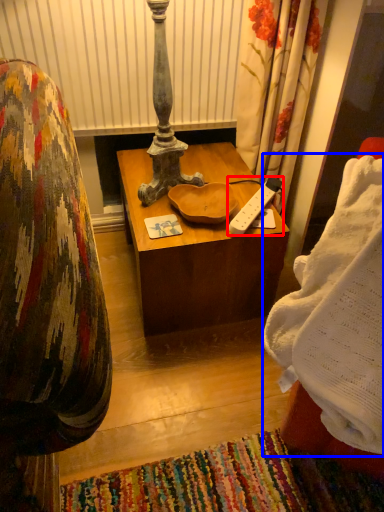
Question: Which object appears closest to the camera in this image, remote control (highlighted by a red box) or blanket (highlighted by a blue box)?

Choices:
 (A) remote control
 (B) blanket

Answer: (B)